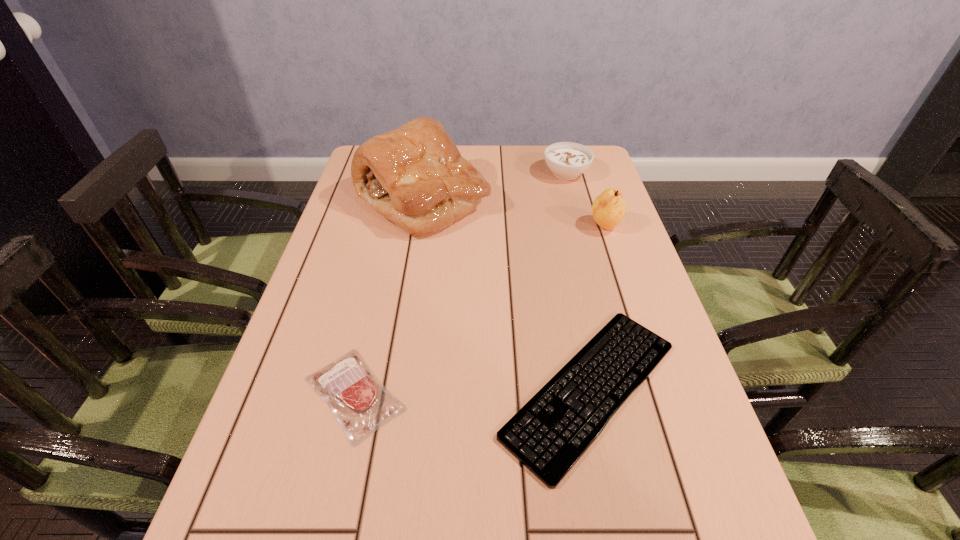
Locate an element on the screen. This screenshot has height=540, width=960. bread is located at coordinates (414, 176).

Identify the location of the fourth shortest object. Image resolution: width=960 pixels, height=540 pixels. (608, 209).

Find the location of `the third tallest object`. the third tallest object is located at coordinates (x=567, y=160).

The image size is (960, 540). I want to click on steak, so point(361,403).

Image resolution: width=960 pixels, height=540 pixels. I want to click on the shortest object, so click(x=551, y=432).

Image resolution: width=960 pixels, height=540 pixels. What are the coordinates of `vacant space located on the filling side of the tallest object` in the screenshot? It's located at pyautogui.click(x=576, y=200).

Identify the location of vacant space located 0.270m on the left of the second tallest object. Image resolution: width=960 pixels, height=540 pixels. [490, 227].

Find the location of a particular element. vacant position located on the left of the soup bowl is located at coordinates 504,173.

What are the coordinates of `vacant region located 0.390m on the right of the fourth tallest object` in the screenshot? It's located at (615, 394).

This screenshot has width=960, height=540. In order to click on vacant space located on the left of the computer keyboard in this screenshot , I will do `click(411, 389)`.